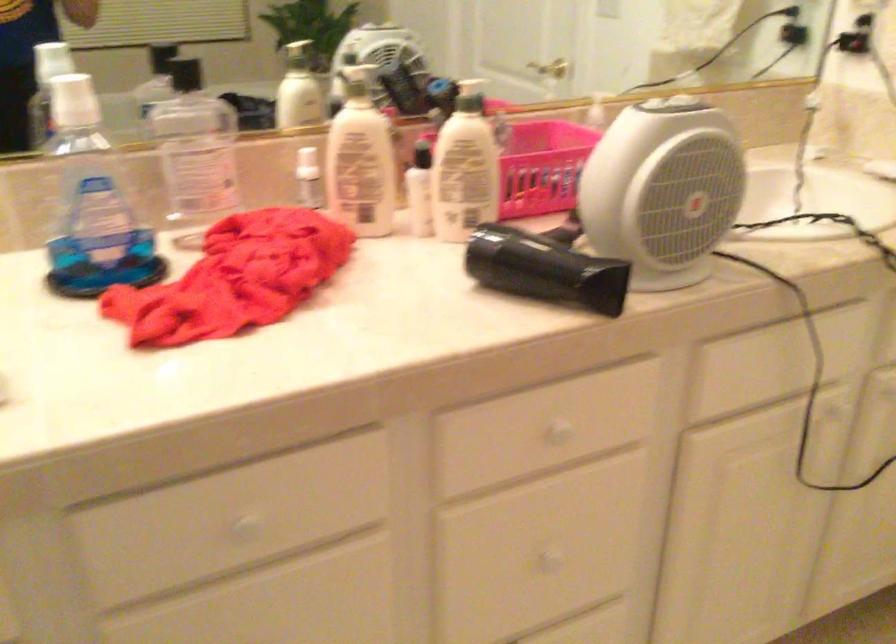
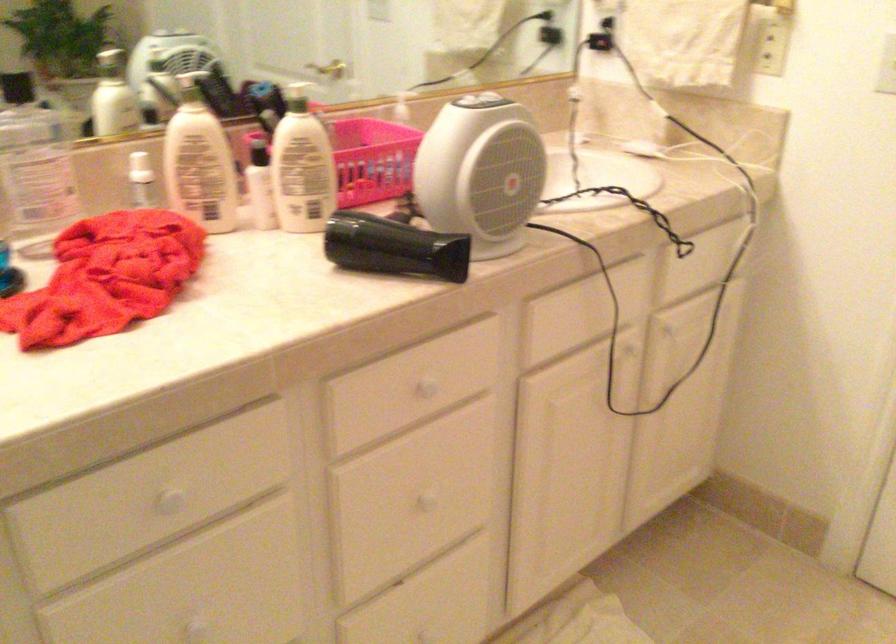
The point at [556,556] is marked in the first image. Where is the corresponding point in the second image?

(426, 500)